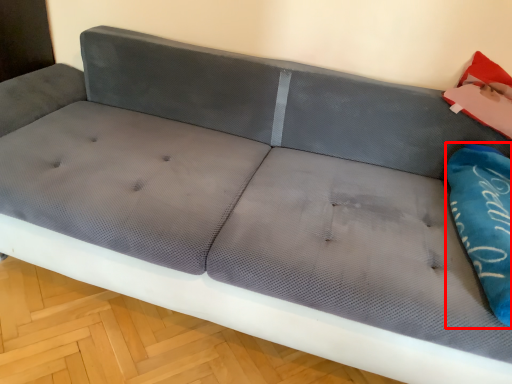
Question: From the image's perspective, what is the correct spatial relationship of pillow (annotated by the red box) in relation to material?

Choices:
 (A) below
 (B) above

Answer: (A)